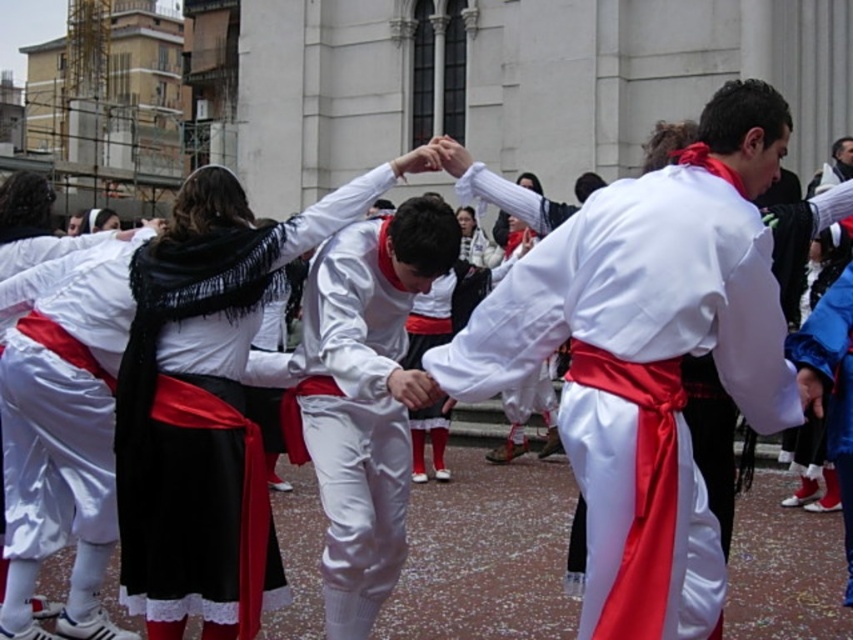
Question: Based on their relative distances, which object is farther from the white satin pants at center?

Choices:
 (A) satin white robe at center
 (B) matte black robe at center

Answer: (A)

Question: Does satin white robe at center appear on the left side of white satin pants at center?

Choices:
 (A) yes
 (B) no

Answer: (B)

Question: Which point appears closest to the camera in this image?

Choices:
 (A) click(x=292, y=404)
 (B) click(x=572, y=404)
 (C) click(x=149, y=280)

Answer: (B)

Question: Which object is positioned farthest from the white satin pants at center?

Choices:
 (A) matte black robe at center
 (B) satin white robe at center

Answer: (B)

Question: Does satin white robe at center come behind matte black robe at center?

Choices:
 (A) yes
 (B) no

Answer: (B)

Question: Can you confirm if satin white robe at center is bigger than white satin pants at center?

Choices:
 (A) no
 (B) yes

Answer: (A)